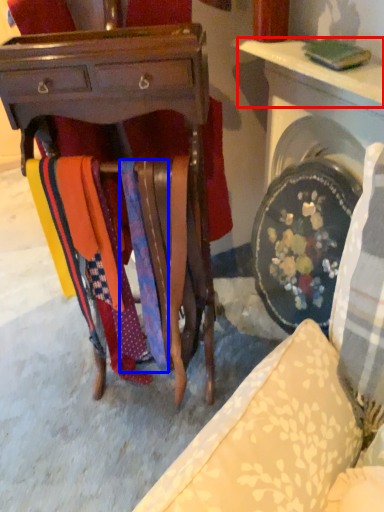
Question: Among these objects, which one is nearest to the camera, table (highlighted by a red box) or tie (highlighted by a blue box)?

Choices:
 (A) table
 (B) tie

Answer: (A)